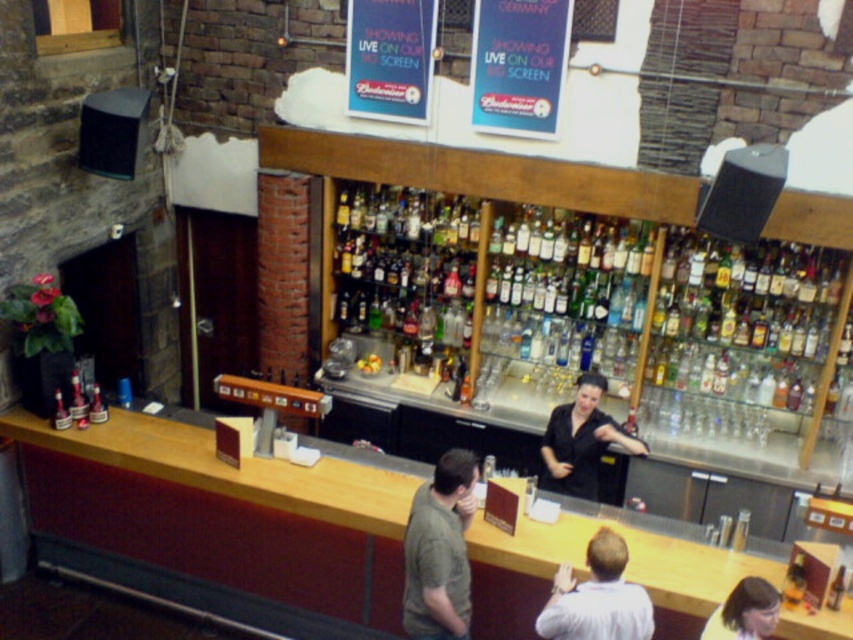
Question: Which object appears farthest from the camera in this image?

Choices:
 (A) black matte shirt at center
 (B) light brown shirt at center
 (C) matte green shirt at center

Answer: (A)

Question: Which is nearer to the light brown shirt at center?

Choices:
 (A) matte green shirt at center
 (B) black matte shirt at center

Answer: (A)

Question: Is light brown shirt at center positioned at the back of blonde hair at lower right?

Choices:
 (A) no
 (B) yes

Answer: (B)

Question: Can you confirm if light brown shirt at center is positioned below black matte shirt at center?

Choices:
 (A) yes
 (B) no

Answer: (A)

Question: Which object is positioned farthest from the black matte shirt at center?

Choices:
 (A) matte green shirt at center
 (B) light brown shirt at center
 (C) blonde hair at lower right

Answer: (A)

Question: Can you confirm if light brown shirt at center is positioned to the right of blonde hair at lower right?

Choices:
 (A) no
 (B) yes

Answer: (A)